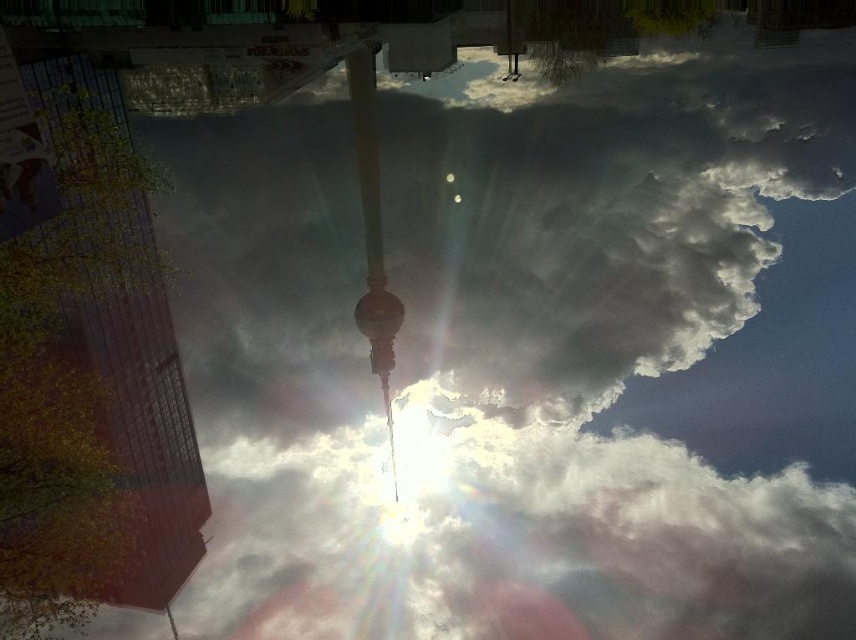
You are a drone operator trying to navigate between two points in the city. You see the point at coordinates point (177, 502) and the point at coordinates point (382, 394). Which point is closer to you?

Point (177, 502) is further to the viewer than point (382, 394). Therefore, point (382, 394) is closer to you.

You are a photographer standing in the city square, wanting to capture a photo of the glassy reflective tower at left and the shiny gold pole at center. Based on their positions, which object would appear larger in your photo?

The glassy reflective tower at left appears larger in the photo because it is closer to the viewer than the shiny gold pole at center.